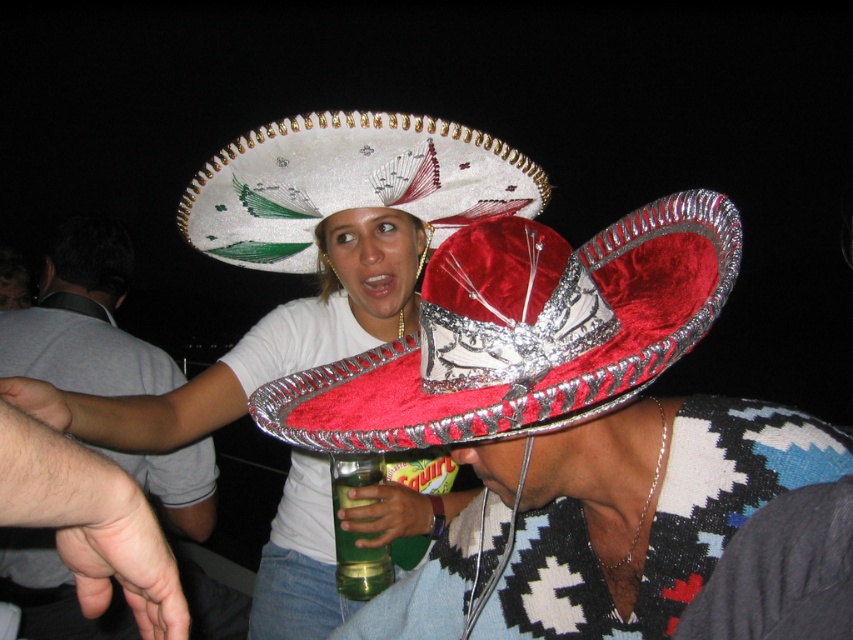
Question: Which of the following is the farthest from the observer?

Choices:
 (A) white fabric sombrero at upper center
 (B) white matte sombrero at upper center

Answer: (A)

Question: Can you confirm if white fabric sombrero at upper center is positioned to the right of smooth gray shirt at upper left?

Choices:
 (A) yes
 (B) no

Answer: (A)

Question: Based on their relative distances, which object is farther from the white fabric sombrero at upper center?

Choices:
 (A) velvet red sombrero at center
 (B) white matte sombrero at upper center
 (C) white felt sombrero at upper center
 (D) smooth gray shirt at upper left

Answer: (D)

Question: Does white felt sombrero at upper center appear under white matte sombrero at upper center?

Choices:
 (A) no
 (B) yes

Answer: (B)

Question: Can you confirm if white matte sombrero at upper center is positioned to the right of green translucent bottle at lower center?

Choices:
 (A) yes
 (B) no

Answer: (B)

Question: Which point is closer to the camera?

Choices:
 (A) green translucent bottle at lower center
 (B) smooth gray shirt at upper left
 (C) white fabric sombrero at upper center
 (D) velvet red sombrero at center

Answer: (D)